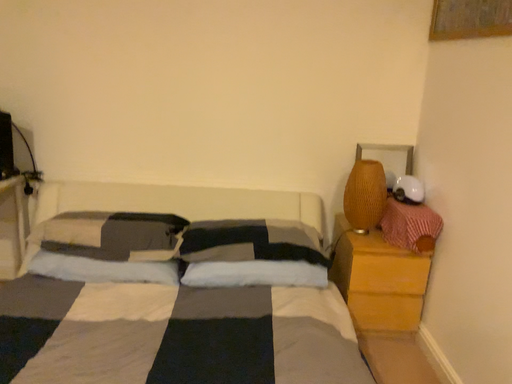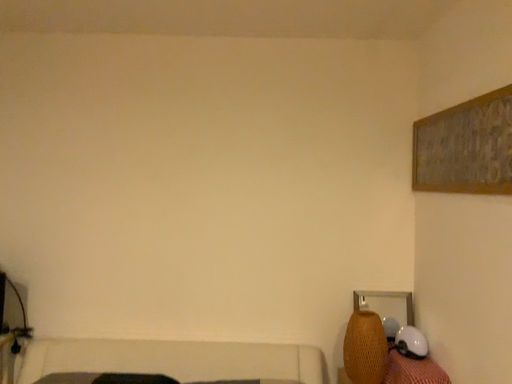
Question: How did the camera likely rotate when shooting the video?

Choices:
 (A) rotated downward
 (B) rotated upward

Answer: (B)